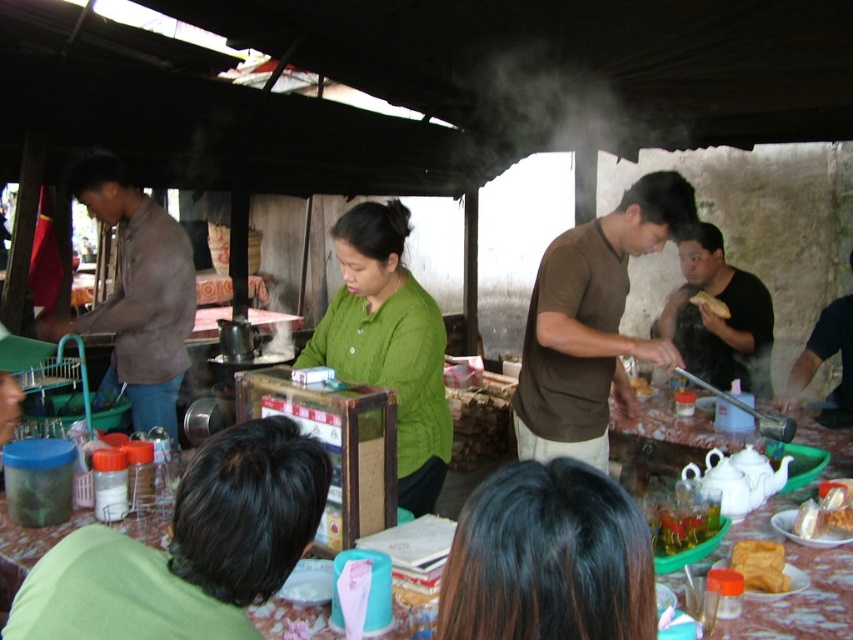
You are a customer at the food stall and notice two golden pastries on the table. The golden fried pastry at lower right and the golden crispy pastry at right. Which one is positioned lower on the table?

The golden fried pastry at lower right is positioned lower on the table than the golden crispy pastry at right.

You are a food delivery person who needs to place a golden crispy pastry at lower right on a table without touching the brown matte shirt at left. Given their sizes, is this possible?

The brown matte shirt at left is larger than the golden crispy pastry at lower right, so yes, there might be enough space to place the pastry without touching the shirt.